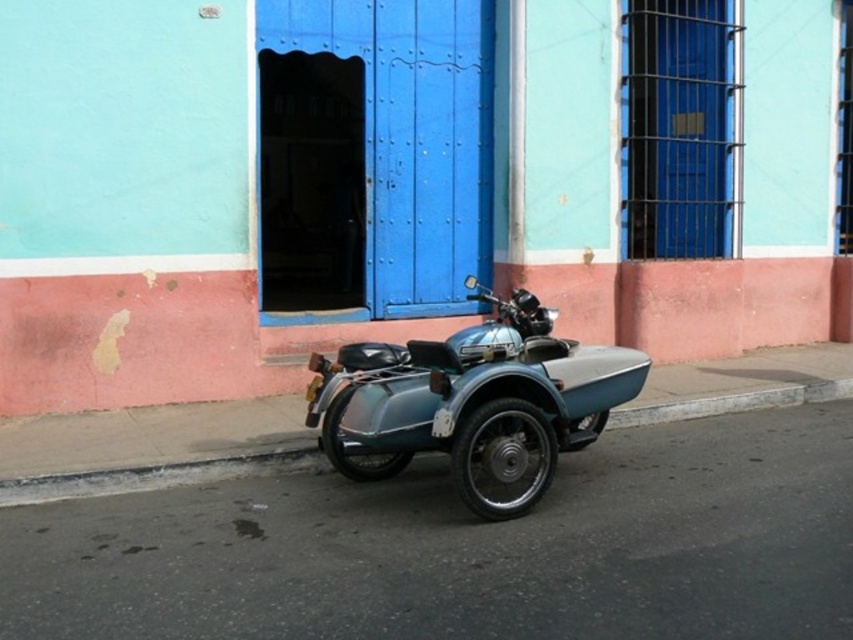
Can you confirm if metallic teal motorcycle at center is bigger than gray concrete curb at lower left?

No, metallic teal motorcycle at center is not bigger than gray concrete curb at lower left.

Is metallic teal motorcycle at center wider than gray concrete curb at lower left?

In fact, metallic teal motorcycle at center might be narrower than gray concrete curb at lower left.

Between point (529, 326) and point (618, 412), which one is positioned behind?

The point (618, 412) is behind.

Identify the location of metallic teal motorcycle at center. The height and width of the screenshot is (640, 853). (473, 401).